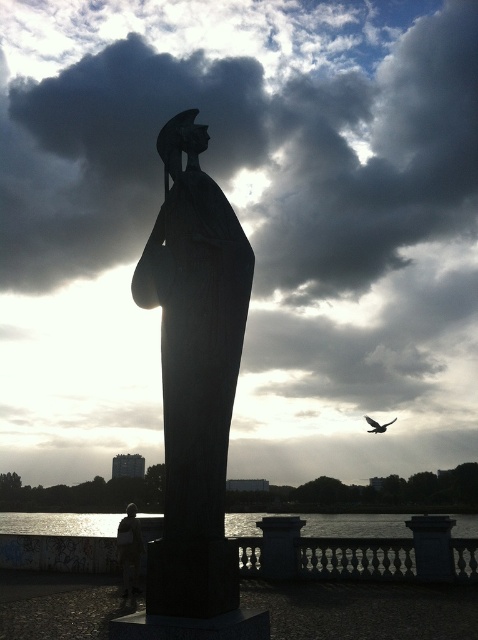
You are an art student analyzing the image. You need to determine which object is wider between the black stone statue at center and the dark feathered bird at upper right. Which one is wider?

The dark feathered bird at upper right is wider than the black stone statue at center according to the description.

You are a tour guide explaining the statues in the park to visitors. You mention that there are two statues at the center of the scene. A visitor asks if they are the same distance from the entrance. You recall that the black stone statue at center is 11.10 meters from dark gray concrete statue at center. Can you determine which statue is closer to the entrance?

The black stone statue at center is 11.10 meters away from the dark gray concrete statue at center. However, without knowing the exact positions of both statues relative to the entrance, it is impossible to determine which one is closer to the entrance based solely on the distance between them.

You are an artist setting up your easel to paint the scene. You notice two types of water surfaces in the image. Which water surface is on top of the other? The options are the glistening water at lower center and the reflective glass water at lower center.

The glistening water at lower center is positioned over the reflective glass water at lower center according to the description.